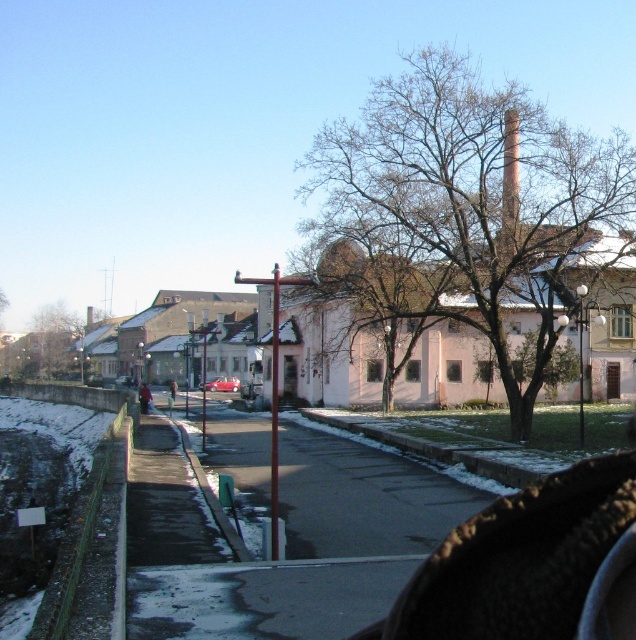
From the picture: You are a photographer trying to capture the shiny red car at center without any obstructions. However, there are bare branches at center in the way. Can you adjust your position to avoid the branches while still keeping the car in the frame?

Result: The bare branches at center are positioned over the shiny red car at center, so moving your camera position slightly downward or to the side could allow you to capture the car without the branches obstructing the view.

You are standing at the center of the road in the image. Looking towards the point marked by coordinates (478,200), what do you see?

The point marked by coordinates (478,200) indicates bare branches at center.